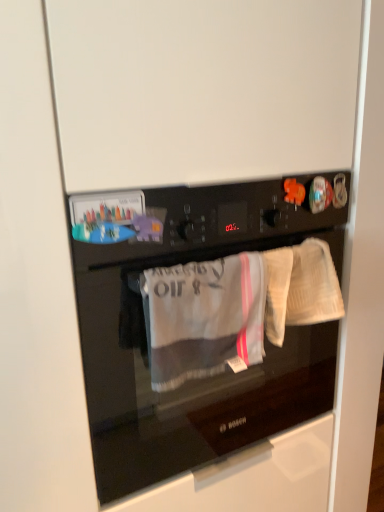
Question: Is white textured towel at right next to black glass oven at center and touching it?

Choices:
 (A) no
 (B) yes

Answer: (A)

Question: From the image's perspective, does white textured towel at right appear lower than black glass oven at center?

Choices:
 (A) no
 (B) yes

Answer: (A)

Question: Is white textured towel at right bigger than black glass oven at center?

Choices:
 (A) no
 (B) yes

Answer: (A)

Question: Is the position of white textured towel at right more distant than that of black glass oven at center?

Choices:
 (A) no
 (B) yes

Answer: (B)

Question: Is white textured towel at right positioned with its back to black glass oven at center?

Choices:
 (A) no
 (B) yes

Answer: (B)

Question: Considering the positions of white textured towel at right and gray cotton towel at center in the image, is white textured towel at right taller or shorter than gray cotton towel at center?

Choices:
 (A) short
 (B) tall

Answer: (A)

Question: Visually, is white textured towel at right positioned to the left or to the right of gray cotton towel at center?

Choices:
 (A) left
 (B) right

Answer: (B)

Question: Is point (322, 241) positioned closer to the camera than point (170, 322)?

Choices:
 (A) closer
 (B) farther

Answer: (B)

Question: Relative to gray cotton towel at center, is white textured towel at right in front or behind?

Choices:
 (A) front
 (B) behind

Answer: (B)

Question: Considering the positions of gray cotton towel at center and white textured towel at right in the image, is gray cotton towel at center wider or thinner than white textured towel at right?

Choices:
 (A) wide
 (B) thin

Answer: (A)

Question: In terms of size, does gray cotton towel at center appear bigger or smaller than white textured towel at right?

Choices:
 (A) small
 (B) big

Answer: (B)

Question: Considering the positions of point (230, 302) and point (289, 322), is point (230, 302) closer or farther from the camera than point (289, 322)?

Choices:
 (A) closer
 (B) farther

Answer: (A)

Question: Considering their positions, is gray cotton towel at center located in front of or behind white textured towel at right?

Choices:
 (A) front
 (B) behind

Answer: (A)

Question: Considering the positions of white textured towel at right and black glass oven at center in the image, is white textured towel at right wider or thinner than black glass oven at center?

Choices:
 (A) thin
 (B) wide

Answer: (A)

Question: From a real-world perspective, is white textured towel at right positioned above or below black glass oven at center?

Choices:
 (A) below
 (B) above

Answer: (B)